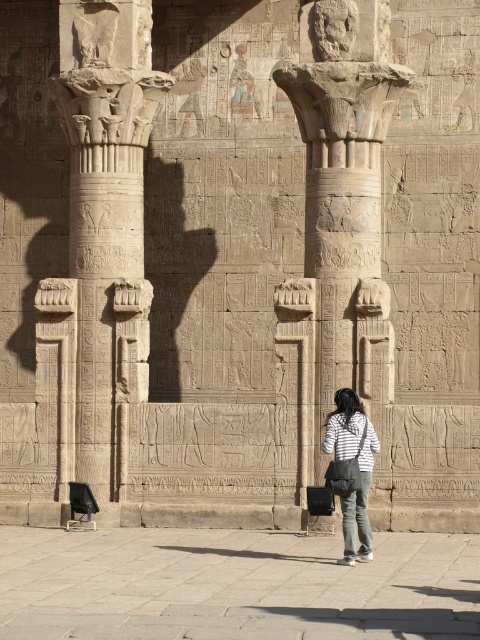
You are an archaeologist examining the ancient Egyptian temple facade. You notice two carved stone columns in the scene. Which of the two columns, the carved stone column at left or the carved stone column at center, is shorter?

The carved stone column at left is shorter compared to the carved stone column at center.

You are a tour guide explaining the temple architecture to visitors. You point out the carved stone column at left and the carved stone column at center. Which column takes up more visual space in the scene?

The carved stone column at center takes up more visual space than the carved stone column at left because it occupies less space.

You are standing at the point closest to the temple facade. There are two points marked in the scene, one labeled as point (344, 170) and the other as point (360, 509). Which point is farther away from you?

Point (344, 170) is behind point (360, 509), so it is farther away from you.